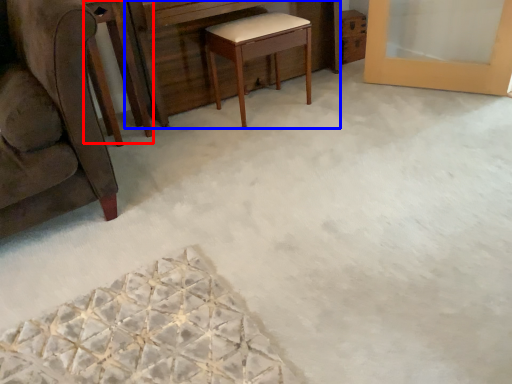
Question: Which of the following is the farthest to the observer, round table (highlighted by a red box) or vanity (highlighted by a blue box)?

Choices:
 (A) round table
 (B) vanity

Answer: (B)